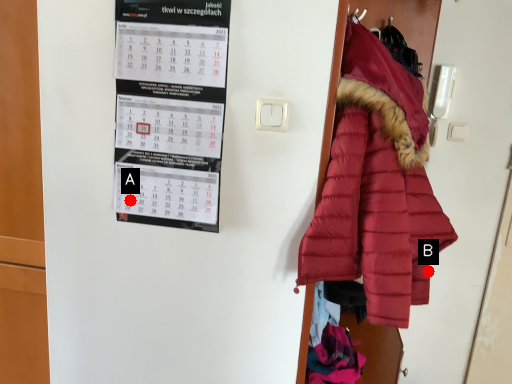
Question: Two points are circled on the image, labeled by A and B beside each circle. Among these points, which one is nearest to the camera?

Choices:
 (A) A is closer
 (B) B is closer

Answer: (A)